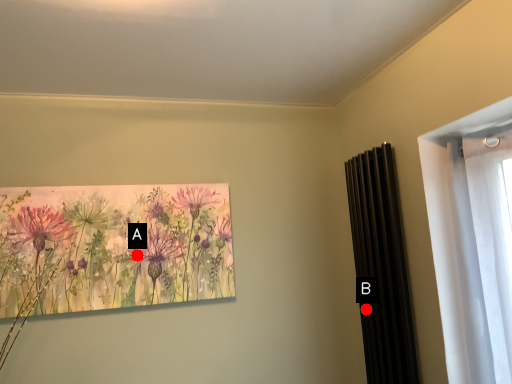
Question: Two points are circled on the image, labeled by A and B beside each circle. Which point appears closest to the camera in this image?

Choices:
 (A) A is closer
 (B) B is closer

Answer: (A)